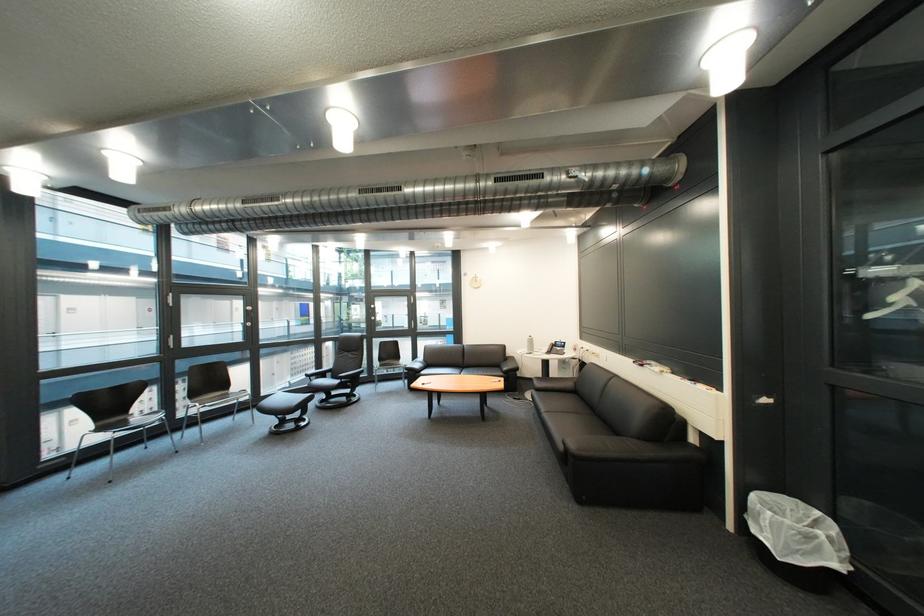
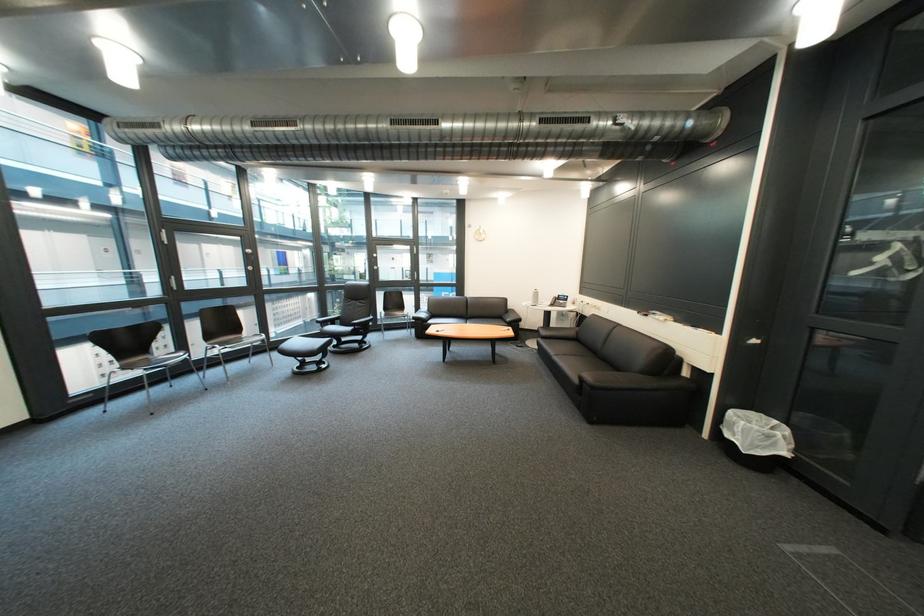
Question: Which direction would the cameraman need to move to produce the second image? Reply with the corresponding letter.

Choices:
 (A) Left
 (B) Right
 (C) Forward
 (D) Backward

Answer: (A)